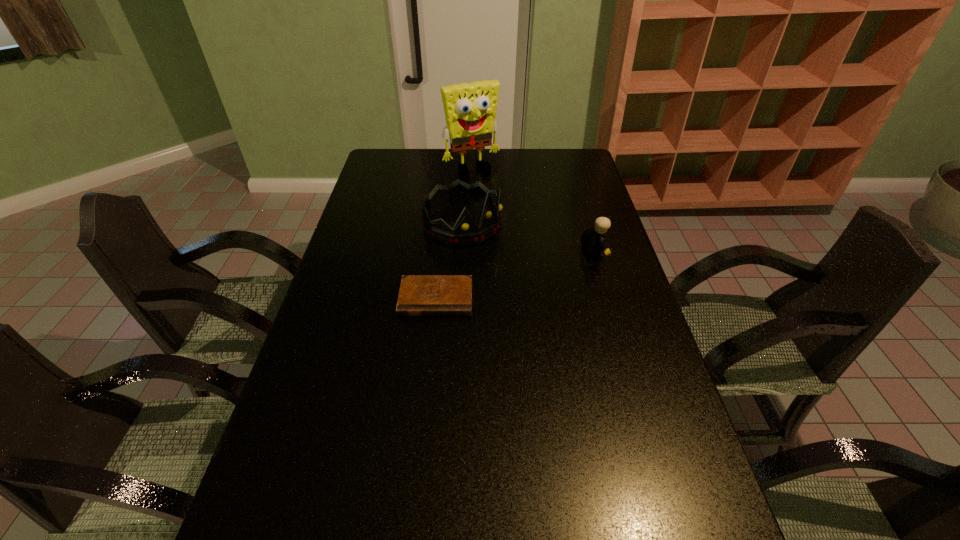
Image resolution: width=960 pixels, height=540 pixels. Find the location of `vacant area that lies between the diary and the rightmost object`. vacant area that lies between the diary and the rightmost object is located at coordinates (515, 275).

Where is `free point between the rightmost object and the sponge`? The width and height of the screenshot is (960, 540). free point between the rightmost object and the sponge is located at coordinates (533, 212).

The image size is (960, 540). Find the location of `unoccupied area between the Lego and the shortest object`. unoccupied area between the Lego and the shortest object is located at coordinates (515, 275).

Where is `empty space that is in between the sponge and the third tallest object`? empty space that is in between the sponge and the third tallest object is located at coordinates coord(533,212).

This screenshot has height=540, width=960. Identify the location of vacant region between the diary and the tiara. (449, 261).

Where is `vacant area that lies between the shortest object and the rightmost object`? The width and height of the screenshot is (960, 540). vacant area that lies between the shortest object and the rightmost object is located at coordinates (515, 275).

Point out which object is positioned as the third nearest to the tiara. Please provide its 2D coordinates. Your answer should be formatted as a tuple, i.e. [(x, y)], where the tuple contains the x and y coordinates of a point satisfying the conditions above.

[(593, 239)]

Identify which object is the third nearest to the shortest object. Please provide its 2D coordinates. Your answer should be formatted as a tuple, i.e. [(x, y)], where the tuple contains the x and y coordinates of a point satisfying the conditions above.

[(470, 108)]

Where is `free space that satisfies the following two spatial constraints: 1. on the front side of the tiara; 2. on the front-facing side of the Lego`? Image resolution: width=960 pixels, height=540 pixels. free space that satisfies the following two spatial constraints: 1. on the front side of the tiara; 2. on the front-facing side of the Lego is located at coordinates (461, 253).

Locate an element on the screen. This screenshot has width=960, height=540. vacant area that satisfies the following two spatial constraints: 1. on the back side of the tallest object; 2. on the right side of the third shortest object is located at coordinates (465, 170).